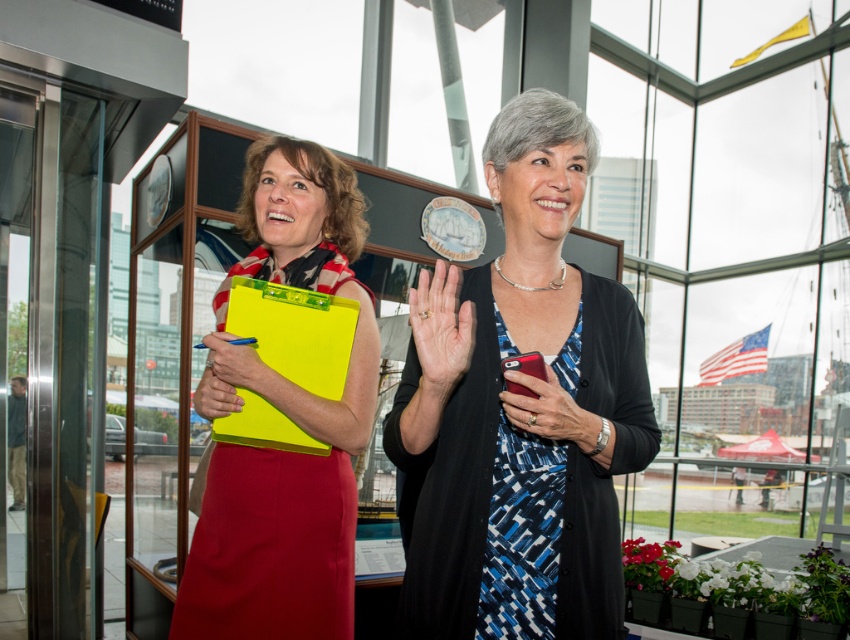
You are a photographer setting up a shot of the two women. You need to ensure that the blue printed dress at center and the matte yellow clipboard at center are both in focus. Which object should you adjust your camera settings to prioritize focusing on first if the dress is wider?

The blue printed dress at center is wider than the matte yellow clipboard at center, so you should prioritize focusing on the blue printed dress at center first to ensure it is in focus.